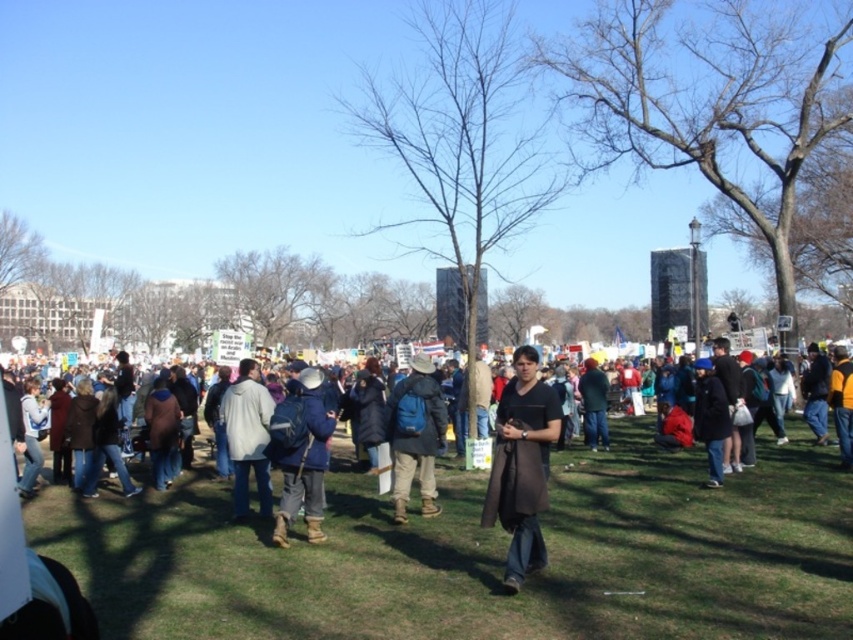
You are a photographer trying to capture both the dark blue fabric jacket at center and the dark brown leather jacket at center in the same frame. Based on their positions, which jacket should you focus on first to ensure both are in the shot?

The dark blue fabric jacket at center is above the dark brown leather jacket at center, so you should focus on the dark brown leather jacket at center first to ensure both are in the shot.

You are a photographer standing at the edge of the park, and you want to take a photo of the blue fabric jacket at center. The camera you are using has a maximum focus range of 9 meters. Will you be able to capture the jacket in focus?

The blue fabric jacket at center is 9.25 meters away from the photographer. Since the camera can only focus up to 9 meters, it won

Looking at this image, you are a photographer trying to capture a photo of the blue backpack at center without the blue fabric jacket at center blocking it. Based on their heights, is this possible?

The blue fabric jacket at center is shorter than the blue backpack at center, so yes, the photographer can capture the blue backpack at center without the blue fabric jacket at center blocking it since the jacket is shorter and less likely to obscure the backpack.